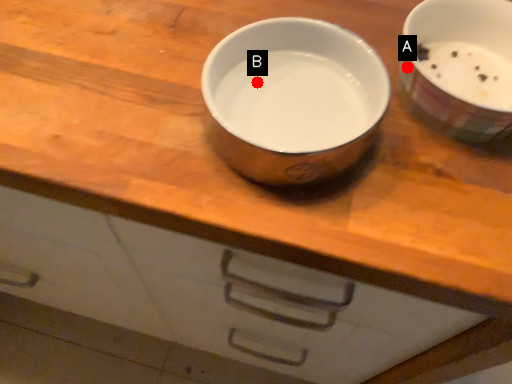
Question: Two points are circled on the image, labeled by A and B beside each circle. Which point is closer to the camera?

Choices:
 (A) A is closer
 (B) B is closer

Answer: (B)